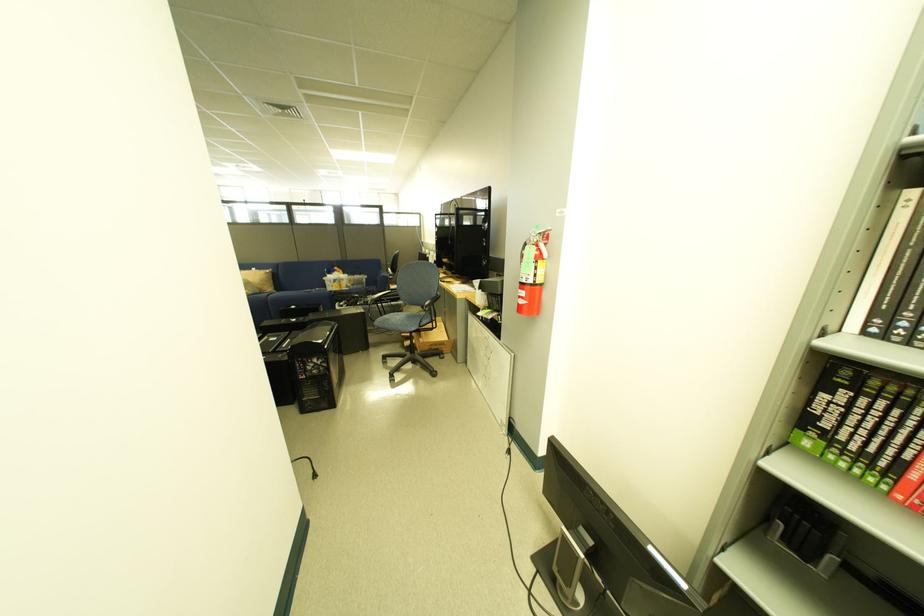
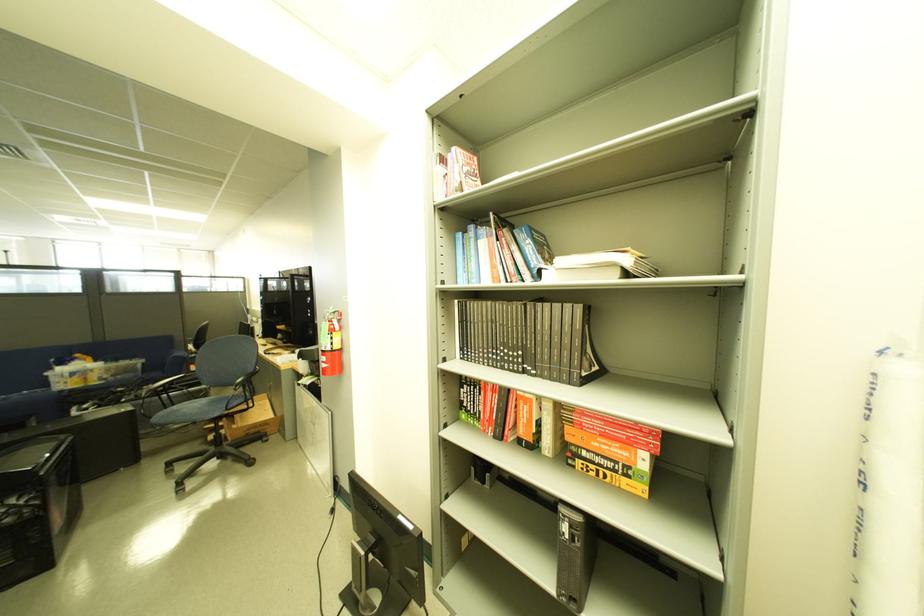
The point at (535, 283) is marked in the first image. Where is the corresponding point in the second image?

(334, 351)